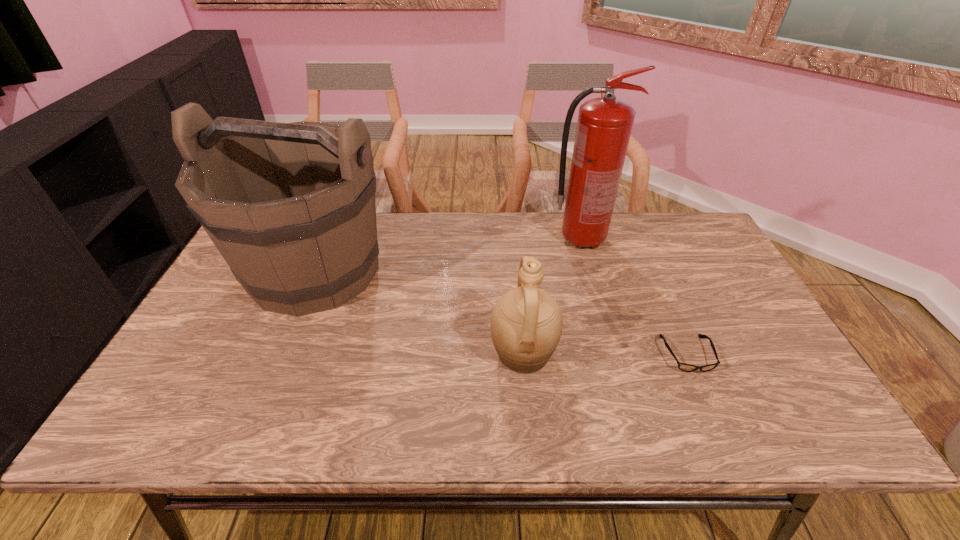
Where is `free space between the leftmost object and the pitcher`? The image size is (960, 540). free space between the leftmost object and the pitcher is located at coordinates (419, 312).

The height and width of the screenshot is (540, 960). Identify the location of free spot between the fire extinguisher and the bucket. (448, 255).

This screenshot has height=540, width=960. In order to click on free space between the second object from left to right and the rightmost object in this screenshot , I will do `click(605, 354)`.

The height and width of the screenshot is (540, 960). Find the location of `free point between the bucket and the fire extinguisher`. free point between the bucket and the fire extinguisher is located at coordinates (448, 255).

Locate an element on the screen. The width and height of the screenshot is (960, 540). vacant point located between the pitcher and the rightmost object is located at coordinates (605, 354).

Identify which object is the third closest to the second shortest object. Please provide its 2D coordinates. Your answer should be formatted as a tuple, i.e. [(x, y)], where the tuple contains the x and y coordinates of a point satisfying the conditions above.

[(604, 125)]

Where is `object that is the nearest to the pitcher`? object that is the nearest to the pitcher is located at coordinates (684, 367).

Locate an element on the screen. The image size is (960, 540). vacant region that satisfies the following two spatial constraints: 1. on the handle side the second object from right to left; 2. on the front side of the pitcher is located at coordinates (613, 353).

What are the coordinates of `free space that satisfies the following two spatial constraints: 1. on the handle side the third object from left to right; 2. on the front side of the leftmost object` in the screenshot? It's located at (589, 270).